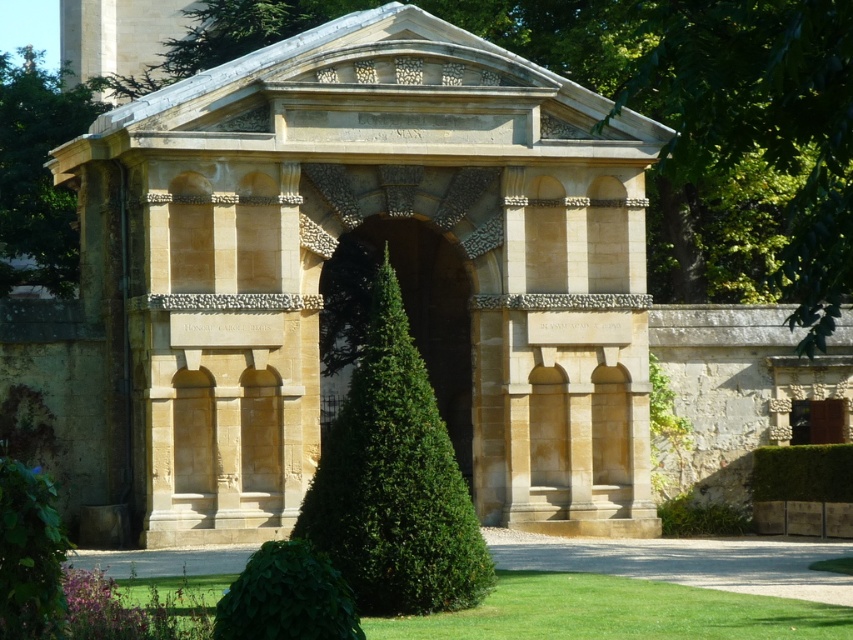
Question: Is green leafy bush at center closer to camera compared to green leafy hedge at lower center?

Choices:
 (A) no
 (B) yes

Answer: (A)

Question: Among these objects, which one is farthest from the camera?

Choices:
 (A) green leafy hedge at lower center
 (B) green leafy bush at center

Answer: (B)

Question: Is green leafy bush at center in front of green leafy hedge at lower center?

Choices:
 (A) no
 (B) yes

Answer: (A)

Question: Which of the following is the farthest from the observer?

Choices:
 (A) (351, 388)
 (B) (314, 580)

Answer: (A)

Question: Which point is closer to the camera?

Choices:
 (A) green leafy hedge at lower center
 (B) green leafy bush at center

Answer: (A)

Question: Is green leafy bush at center bigger than green leafy hedge at lower center?

Choices:
 (A) yes
 (B) no

Answer: (A)